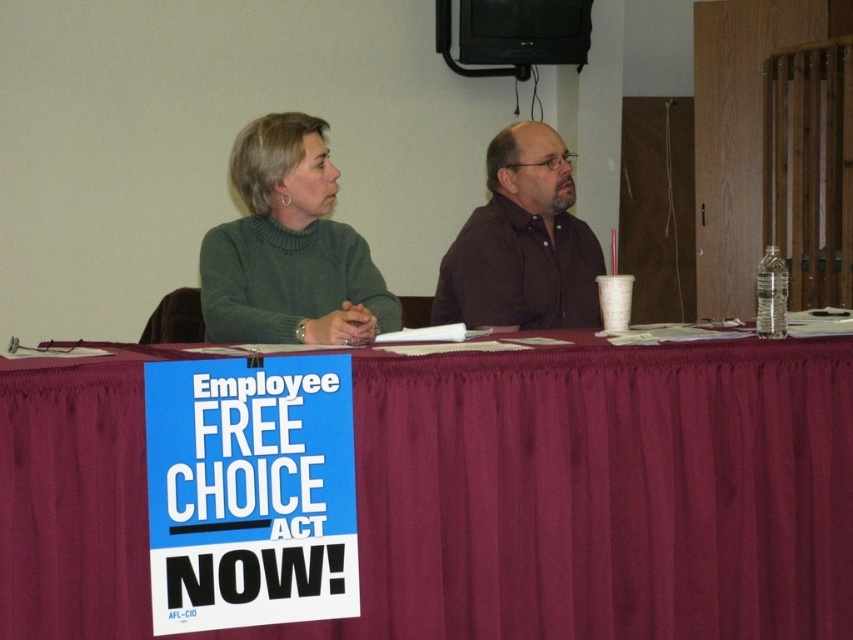
Question: Which of the following is the closest to the observer?

Choices:
 (A) brown matte shirt at center
 (B) maroon fabric table at center
 (C) green sweater at upper left

Answer: (B)

Question: Is the position of maroon fabric table at center less distant than that of green sweater at upper left?

Choices:
 (A) no
 (B) yes

Answer: (B)

Question: Can you confirm if maroon fabric table at center is positioned to the right of brown matte shirt at center?

Choices:
 (A) yes
 (B) no

Answer: (B)

Question: Can you confirm if maroon fabric table at center is wider than green sweater at upper left?

Choices:
 (A) yes
 (B) no

Answer: (A)

Question: Estimate the real-world distances between objects in this image. Which object is farther from the green sweater at upper left?

Choices:
 (A) brown matte shirt at center
 (B) maroon fabric table at center

Answer: (B)

Question: Which point is farther to the camera?

Choices:
 (A) (834, 627)
 (B) (509, 188)
 (C) (271, 248)

Answer: (B)